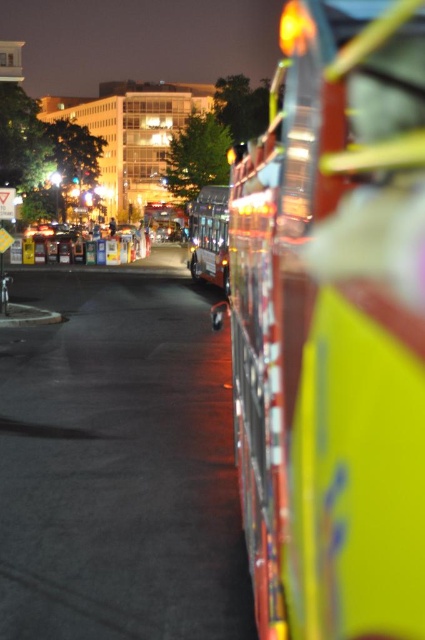
You are standing at the bus stop and want to take a photo of the newspaper vending machines. You notice two points marked in the image. Which point, point (359,61) or point (215,250), is closer to your camera lens?

Point (359,61) is closer to the camera than point (215,250).

You are a pedestrian trying to cross the street and see the metallic silver fire truck at right and the metallic silver bus at center. Which one is closer to the street level?

The metallic silver fire truck at right is closer to the street level because it is positioned below the metallic silver bus at center.